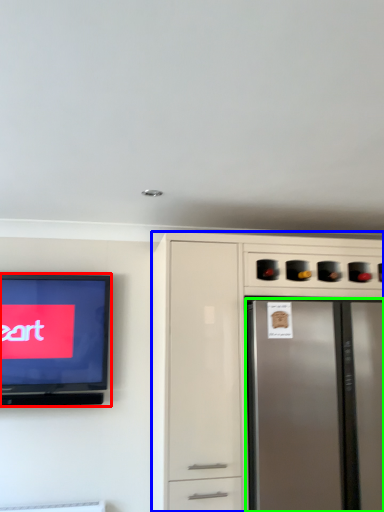
Question: Which object is positioned farthest from television (highlighted by a red box)? Select from cabinetry (highlighted by a blue box) and refrigerator (highlighted by a green box).

Choices:
 (A) cabinetry
 (B) refrigerator

Answer: (B)